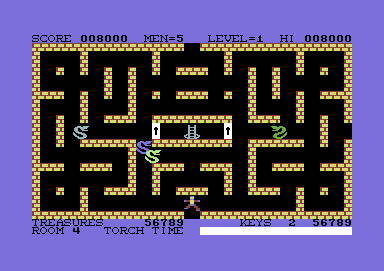
The image size is (384, 271). Find the location of `keys`. keys is located at coordinates (252, 221).